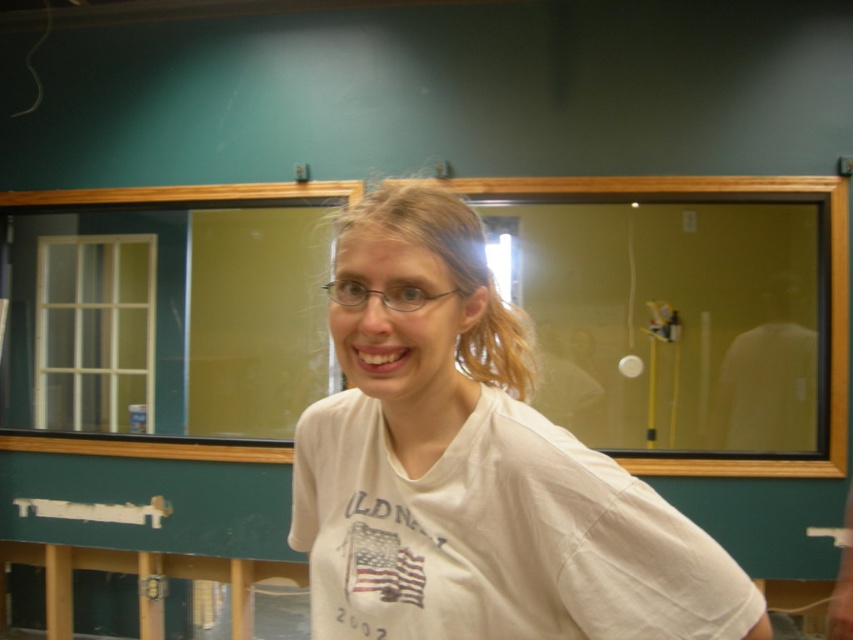
Between white cotton t-shirt at center and clear plastic glasses at center, which one has less height?

clear plastic glasses at center

Can you confirm if white cotton t-shirt at center is positioned to the right of clear plastic glasses at center?

Correct, you'll find white cotton t-shirt at center to the right of clear plastic glasses at center.

At what (x,y) coordinates should I click in order to perform the action: click on white cotton t-shirt at center. Please return your answer as a coordinate pair (x, y). Image resolution: width=853 pixels, height=640 pixels. Looking at the image, I should click on (476, 470).